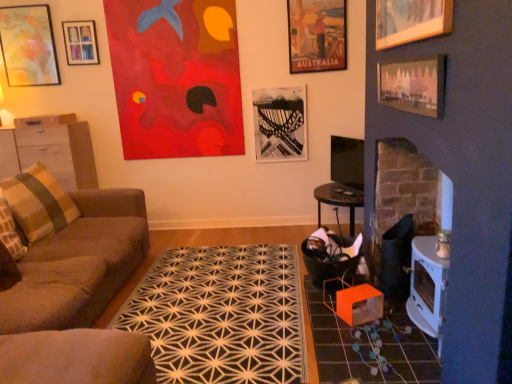
Question: Considering the relative sizes of pink paper picture frame at upper right, which ranks as the sixth picture frame in left-to-right order, and brown wood cabinet at left in the image provided, is pink paper picture frame at upper right, which ranks as the sixth picture frame in left-to-right order, shorter than brown wood cabinet at left?

Choices:
 (A) yes
 (B) no

Answer: (A)

Question: Is brown wood cabinet at left at the back of pink paper picture frame at upper right, which is the 2th picture frame from front to back?

Choices:
 (A) yes
 (B) no

Answer: (B)

Question: Is pink paper picture frame at upper right, which ranks as the sixth picture frame in left-to-right order, at the right side of brown wood cabinet at left?

Choices:
 (A) no
 (B) yes

Answer: (B)

Question: Is pink paper picture frame at upper right, arranged as the first picture frame when viewed from the right, outside of brown wood cabinet at left?

Choices:
 (A) yes
 (B) no

Answer: (A)

Question: From the image's perspective, is pink paper picture frame at upper right, which is the 2th picture frame from front to back, beneath brown wood cabinet at left?

Choices:
 (A) no
 (B) yes

Answer: (A)

Question: Visually, is pink paper picture frame at upper right, which is the 2th picture frame from front to back, positioned to the left or to the right of matte wooden picture frame at upper left, marked as the 1th picture frame in a left-to-right arrangement?

Choices:
 (A) left
 (B) right

Answer: (B)

Question: Does point (399, 72) appear closer or farther from the camera than point (17, 9)?

Choices:
 (A) farther
 (B) closer

Answer: (B)

Question: Considering the positions of pink paper picture frame at upper right, which is the 2th picture frame from front to back, and matte wooden picture frame at upper left, marked as the 1th picture frame in a left-to-right arrangement, in the image, is pink paper picture frame at upper right, which is the 2th picture frame from front to back, taller or shorter than matte wooden picture frame at upper left, marked as the 1th picture frame in a left-to-right arrangement,?

Choices:
 (A) short
 (B) tall

Answer: (A)

Question: Based on their sizes in the image, would you say pink paper picture frame at upper right, which appears as the fifth picture frame when viewed from the back, is bigger or smaller than matte wooden picture frame at upper left, the 6th picture frame in the right-to-left sequence?

Choices:
 (A) small
 (B) big

Answer: (A)

Question: Relative to black geometric rug at center, is black and white photograph at center, the fourth picture frame from the right, in front or behind?

Choices:
 (A) behind
 (B) front

Answer: (A)

Question: From a real-world perspective, is black and white photograph at center, the fourth picture frame from the right, physically located above or below black geometric rug at center?

Choices:
 (A) above
 (B) below

Answer: (A)

Question: In terms of height, does black and white photograph at center, the fourth picture frame from the right, look taller or shorter compared to black geometric rug at center?

Choices:
 (A) tall
 (B) short

Answer: (A)

Question: Is black and white photograph at center, the fourth picture frame from the right, to the left or to the right of black geometric rug at center in the image?

Choices:
 (A) right
 (B) left

Answer: (A)

Question: Based on their sizes in the image, would you say matte wooden picture frame at upper left, the 6th picture frame in the right-to-left sequence, is bigger or smaller than brown fabric couch at left?

Choices:
 (A) big
 (B) small

Answer: (B)

Question: Is matte wooden picture frame at upper left, the 6th picture frame in the right-to-left sequence, situated inside brown fabric couch at left or outside?

Choices:
 (A) inside
 (B) outside

Answer: (B)